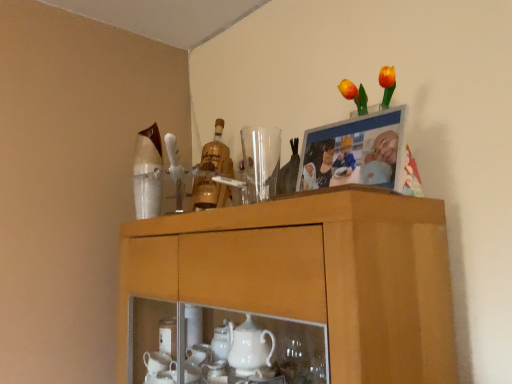
Question: Considering the relative sizes of transparent glass at upper center and wooden cabinet at upper center in the image provided, is transparent glass at upper center bigger than wooden cabinet at upper center?

Choices:
 (A) no
 (B) yes

Answer: (A)

Question: Is transparent glass at upper center positioned in front of wooden cabinet at upper center?

Choices:
 (A) no
 (B) yes

Answer: (A)

Question: Can you confirm if transparent glass at upper center is smaller than wooden cabinet at upper center?

Choices:
 (A) no
 (B) yes

Answer: (B)

Question: Is transparent glass at upper center positioned with its back to wooden cabinet at upper center?

Choices:
 (A) no
 (B) yes

Answer: (A)

Question: From the image's perspective, is transparent glass at upper center on wooden cabinet at upper center?

Choices:
 (A) yes
 (B) no

Answer: (A)

Question: From a real-world perspective, is gold glass bottle at center physically located above or below wooden cabinet at upper center?

Choices:
 (A) above
 (B) below

Answer: (A)

Question: Choose the correct answer: Is gold glass bottle at center inside wooden cabinet at upper center or outside it?

Choices:
 (A) inside
 (B) outside

Answer: (B)

Question: Considering the positions of gold glass bottle at center and wooden cabinet at upper center in the image, is gold glass bottle at center bigger or smaller than wooden cabinet at upper center?

Choices:
 (A) small
 (B) big

Answer: (A)

Question: Is gold glass bottle at center in front of or behind wooden cabinet at upper center in the image?

Choices:
 (A) front
 (B) behind

Answer: (B)

Question: Is wooden cabinet at upper center wider or thinner than gold glass bottle at center?

Choices:
 (A) thin
 (B) wide

Answer: (B)

Question: Based on their positions, is wooden cabinet at upper center located to the left or right of gold glass bottle at center?

Choices:
 (A) right
 (B) left

Answer: (A)

Question: Considering the positions of point (379, 309) and point (211, 201), is point (379, 309) closer or farther from the camera than point (211, 201)?

Choices:
 (A) closer
 (B) farther

Answer: (A)

Question: Considering the positions of wooden cabinet at upper center and gold glass bottle at center in the image, is wooden cabinet at upper center taller or shorter than gold glass bottle at center?

Choices:
 (A) tall
 (B) short

Answer: (A)

Question: Does point (181, 269) appear closer or farther from the camera than point (261, 150)?

Choices:
 (A) closer
 (B) farther

Answer: (A)

Question: Is wooden cabinet at upper center in front of or behind transparent glass at upper center in the image?

Choices:
 (A) behind
 (B) front

Answer: (B)